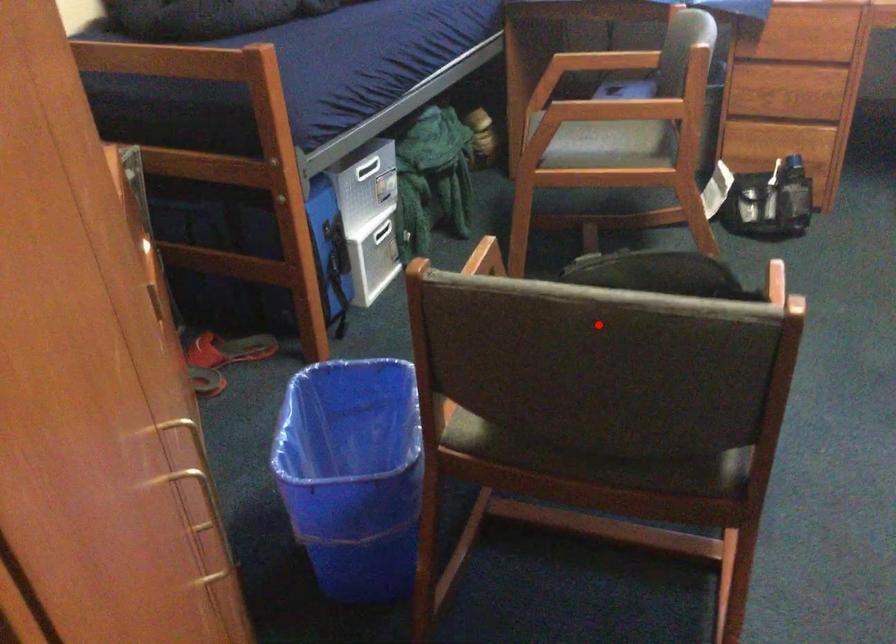
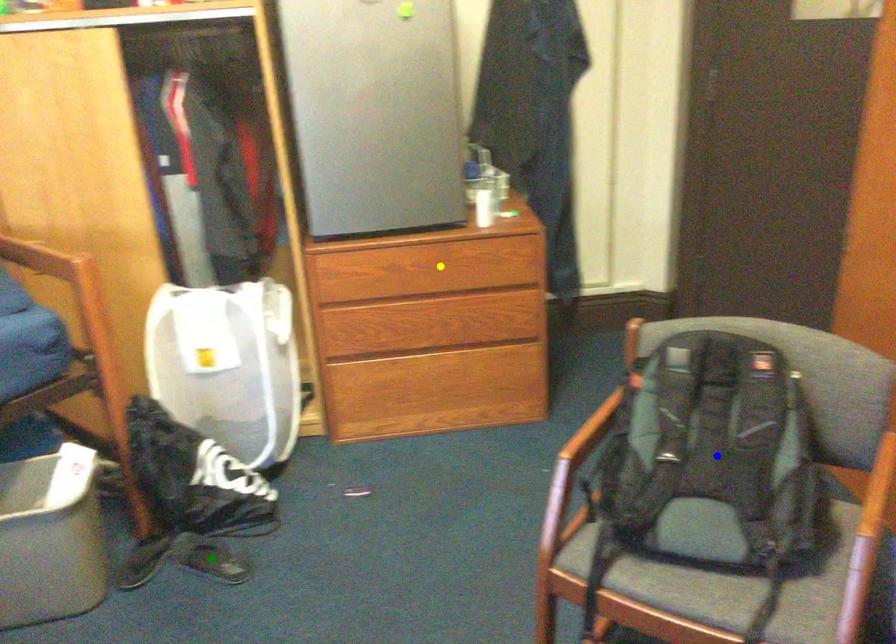
Question: I am providing you with two images of the same scene from different viewpoints. A red point is marked on the first image. You are given multiple points on the second image. Which point in image 2 is actually the same real-world point as the red point in image 1?

Choices:
 (A) green point
 (B) yellow point
 (C) blue point

Answer: (C)